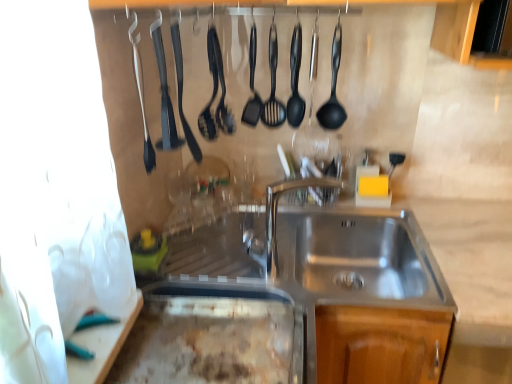
Question: Does black rubber spatula at upper center, placed as the second silverware when sorted from left to right, have a greater height compared to black rubber spatula at center, which is the third utensil from right to left?

Choices:
 (A) yes
 (B) no

Answer: (B)

Question: Is black rubber spatula at upper center, acting as the second silverware starting from the right, surrounding black rubber spatula at center, which is the third utensil from right to left?

Choices:
 (A) no
 (B) yes

Answer: (A)

Question: Is black rubber spatula at upper center, placed as the second silverware when sorted from left to right, thinner than black rubber spatula at center, which is the third utensil from right to left?

Choices:
 (A) yes
 (B) no

Answer: (A)

Question: Is black rubber spatula at upper center, acting as the second silverware starting from the right, not near black rubber spatula at center, which appears as the 1th utensil when viewed from the left?

Choices:
 (A) yes
 (B) no

Answer: (B)

Question: Considering the relative sizes of black rubber spatula at upper center, acting as the second silverware starting from the right, and black rubber spatula at center, which appears as the 1th utensil when viewed from the left, in the image provided, is black rubber spatula at upper center, acting as the second silverware starting from the right, bigger than black rubber spatula at center, which appears as the 1th utensil when viewed from the left,?

Choices:
 (A) yes
 (B) no

Answer: (B)

Question: Is black plastic spatula at center, which appears as the 1th utensil when viewed from the right, taller or shorter than black rubber spatula at upper left, which is the 3th silverware in right-to-left order?

Choices:
 (A) short
 (B) tall

Answer: (B)

Question: From the image's perspective, is black plastic spatula at center, which appears as the 1th utensil when viewed from the right, positioned above or below black rubber spatula at upper left, the first silverware when ordered from left to right?

Choices:
 (A) above
 (B) below

Answer: (A)

Question: Is black plastic spatula at center, which appears as the 1th utensil when viewed from the right, bigger or smaller than black rubber spatula at upper left, which is the 3th silverware in right-to-left order?

Choices:
 (A) big
 (B) small

Answer: (A)

Question: Relative to black rubber spatula at upper left, which is the 3th silverware in right-to-left order, is black plastic spatula at center, which appears as the 1th utensil when viewed from the right, in front or behind?

Choices:
 (A) behind
 (B) front

Answer: (A)

Question: Does point (254, 34) appear closer or farther from the camera than point (328, 180)?

Choices:
 (A) closer
 (B) farther

Answer: (A)

Question: From a real-world perspective, is black plastic spatula at center, which is counted as the 2th utensil, starting from the right, positioned above or below polished stainless steel faucet at center?

Choices:
 (A) below
 (B) above

Answer: (B)

Question: Looking at their shapes, would you say black plastic spatula at center, the second utensil positioned from the left, is wider or thinner than polished stainless steel faucet at center?

Choices:
 (A) thin
 (B) wide

Answer: (A)

Question: Is black plastic spatula at center, the second utensil positioned from the left, taller or shorter than polished stainless steel faucet at center?

Choices:
 (A) tall
 (B) short

Answer: (A)

Question: Does point (266, 236) appear closer or farther from the camera than point (197, 152)?

Choices:
 (A) farther
 (B) closer

Answer: (B)

Question: Based on their sizes in the image, would you say polished stainless steel faucet at center is bigger or smaller than black rubber spatula at upper center, the 1th silverware in the right-to-left sequence?

Choices:
 (A) big
 (B) small

Answer: (A)